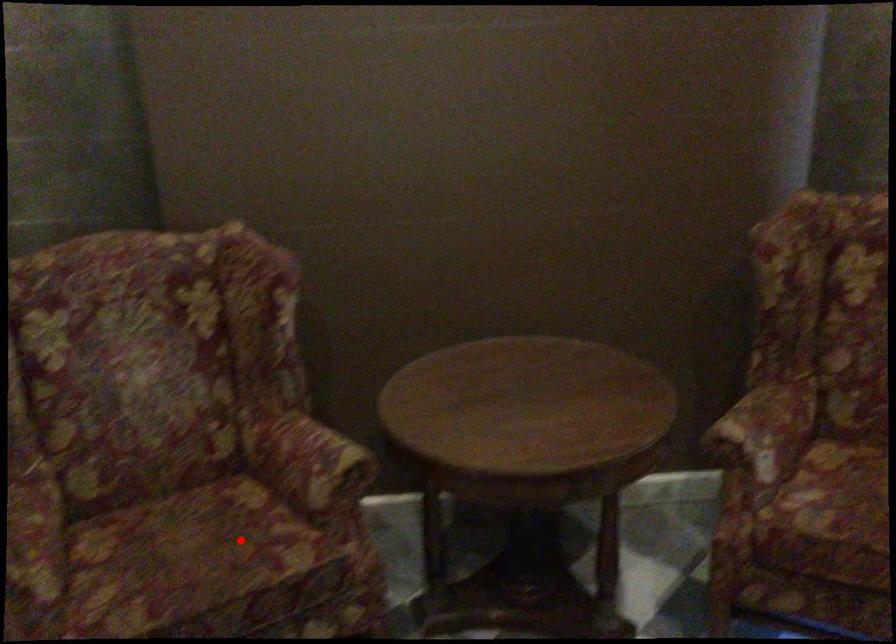
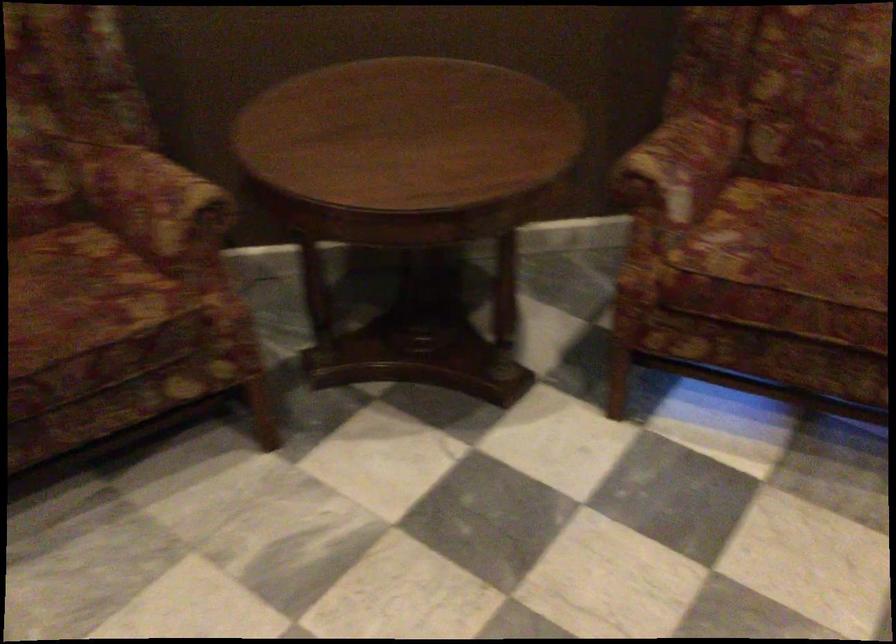
Find the pixel in the second image that matches the highlighted location in the first image.

(80, 292)